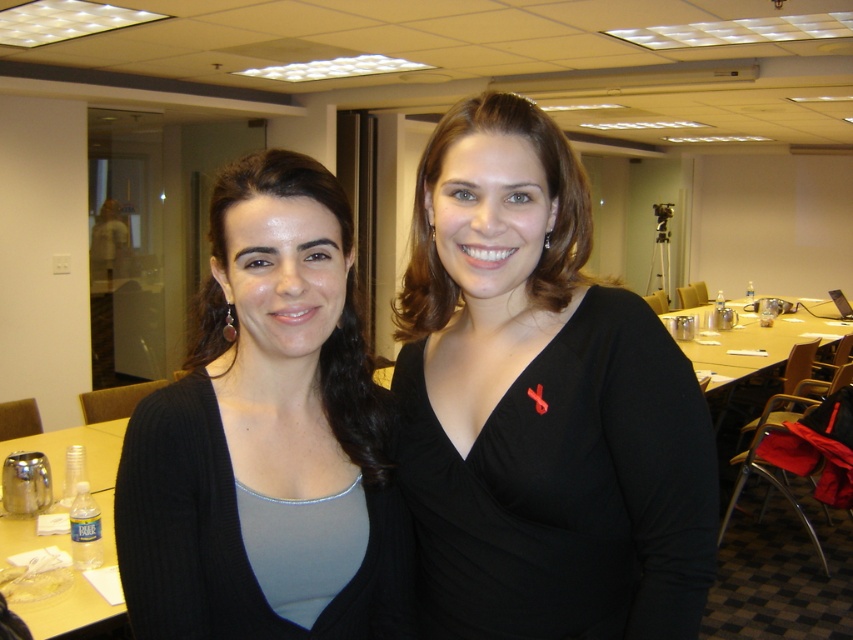
Which is in front, point (85, 604) or point (717, 337)?

Point (85, 604) is in front.

In order to click on clear plastic water bottle at lower left in this screenshot , I will do `click(86, 465)`.

Locate an element on the screen. This screenshot has height=640, width=853. clear plastic water bottle at lower left is located at coordinates click(x=86, y=465).

At what (x,y) coordinates should I click in order to perform the action: click on clear plastic water bottle at lower left. Please return your answer as a coordinate pair (x, y). Looking at the image, I should click on (86, 465).

Which is in front, point (595, 524) or point (74, 625)?

Positioned in front is point (595, 524).

Between black matte dress at center and clear plastic water bottle at lower left, which one has more height?

With more height is black matte dress at center.

The image size is (853, 640). In order to click on black matte dress at center in this screenshot , I will do `click(540, 404)`.

Does matte black cardigan at center have a smaller size compared to clear plastic water bottle at lower left?

Correct, matte black cardigan at center occupies less space than clear plastic water bottle at lower left.

Is point (202, 536) farther from camera compared to point (88, 616)?

No.

Where is `matte black cardigan at center`? The image size is (853, 640). matte black cardigan at center is located at coordinates (267, 436).